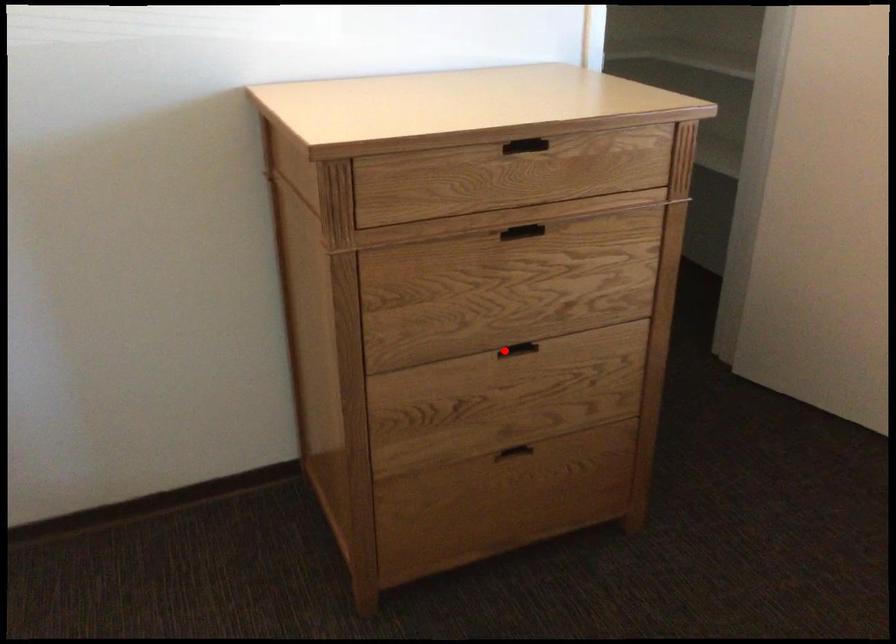
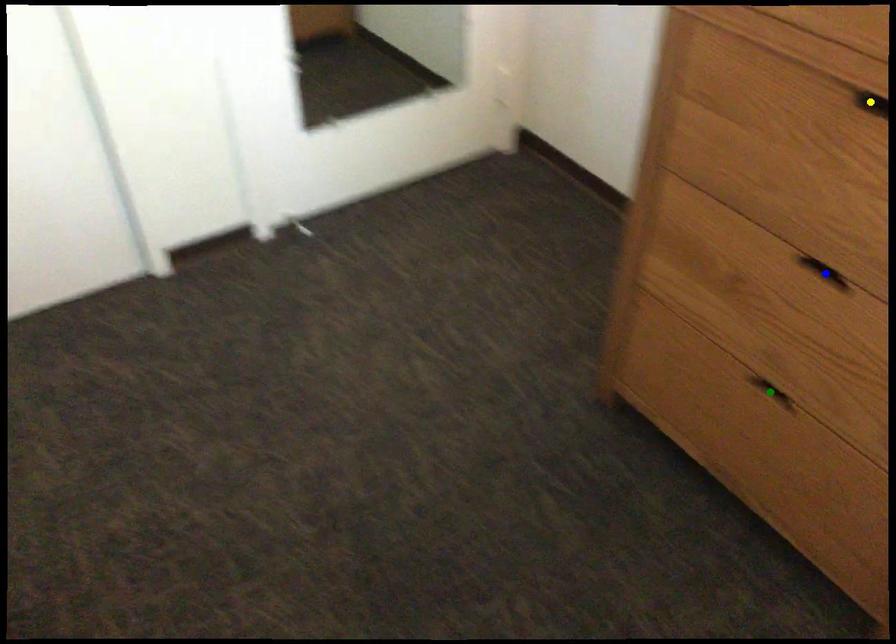
Question: I am providing you with two images of the same scene from different viewpoints. A red point is marked on the first image. You are given multiple points on the second image. Which mark in image 2 goes with the point in image 1?

Choices:
 (A) yellow point
 (B) blue point
 (C) green point

Answer: (B)